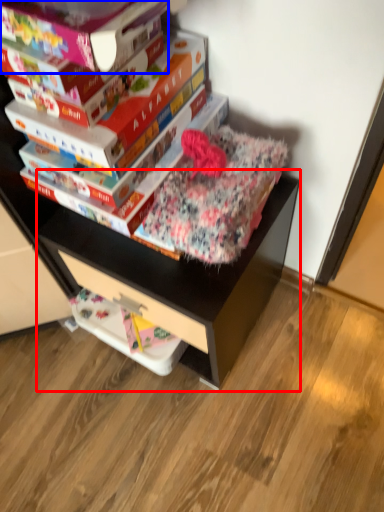
Question: Which object appears closest to the camera in this image, computer desk (highlighted by a red box) or paperback book (highlighted by a blue box)?

Choices:
 (A) computer desk
 (B) paperback book

Answer: (B)